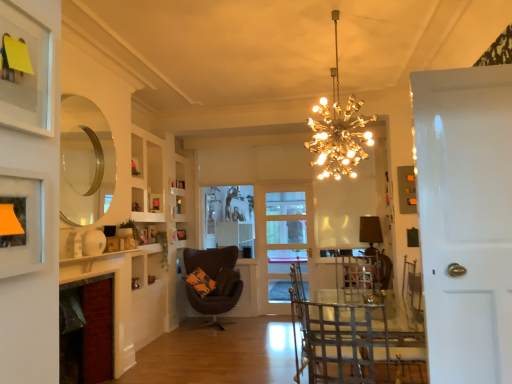
This screenshot has width=512, height=384. What do you see at coordinates (465, 220) in the screenshot? I see `white glossy door at right, the 1th door when ordered from front to back` at bounding box center [465, 220].

Find the location of a particular element. gold metallic chandelier at upper center is located at coordinates (338, 130).

Measure the distance between metallic wrought iron chair at lower center, the second chair from the back, and camera.

metallic wrought iron chair at lower center, the second chair from the back, and camera are 2.04 meters apart.

The image size is (512, 384). What do you see at coordinates (282, 238) in the screenshot? I see `light wood glass door at center, placed as the first door when sorted from back to front` at bounding box center [282, 238].

The height and width of the screenshot is (384, 512). What are the coordinates of `matte black picture frame at upper center, which appears as the 3th picture frame when viewed from the right` in the screenshot? It's located at (180, 184).

At what (x,y) coordinates should I click in order to perform the action: click on white glossy door at right, which ranks as the second door in back-to-front order. Please return your answer as a coordinate pair (x, y). Looking at the image, I should click on (465, 220).

Where is `the 3rd picture frame to the left of the matte gray picture frame at upper right, arranged as the fourth picture frame when viewed from the back, counting from the anchor's position`? Image resolution: width=512 pixels, height=384 pixels. the 3rd picture frame to the left of the matte gray picture frame at upper right, arranged as the fourth picture frame when viewed from the back, counting from the anchor's position is located at coordinates (181, 234).

Is the depth of matte gray picture frame at upper right, acting as the fifth picture frame starting from the left, less than that of matte black picture frame at center, which is the second picture frame in left-to-right order?

That is True.

From a real-world perspective, is matte gray picture frame at upper right, marked as the 1th picture frame in a right-to-left arrangement, located higher than matte black picture frame at center, the first picture frame in the back-to-front sequence?

Indeed, from a real-world perspective, matte gray picture frame at upper right, marked as the 1th picture frame in a right-to-left arrangement, stands above matte black picture frame at center, the first picture frame in the back-to-front sequence.

From the image's perspective, between matte gray picture frame at upper right, which appears as the second picture frame when viewed from the front, and matte black picture frame at center, the fourth picture frame when ordered from right to left, which one is located above?

matte gray picture frame at upper right, which appears as the second picture frame when viewed from the front, is shown above in the image.

Based on the photo, is red brick fireplace at lower left wider or thinner than matte gray picture frame at upper right, marked as the 1th picture frame in a right-to-left arrangement?

Clearly, red brick fireplace at lower left has more width compared to matte gray picture frame at upper right, marked as the 1th picture frame in a right-to-left arrangement.

From the image's perspective, is red brick fireplace at lower left on top of matte gray picture frame at upper right, arranged as the fourth picture frame when viewed from the back?

No, from the image's perspective, red brick fireplace at lower left is not above matte gray picture frame at upper right, arranged as the fourth picture frame when viewed from the back.

Considering the relative sizes of red brick fireplace at lower left and matte gray picture frame at upper right, marked as the 1th picture frame in a right-to-left arrangement, in the image provided, is red brick fireplace at lower left shorter than matte gray picture frame at upper right, marked as the 1th picture frame in a right-to-left arrangement,?

Incorrect, the height of red brick fireplace at lower left does not fall short of that of matte gray picture frame at upper right, marked as the 1th picture frame in a right-to-left arrangement.

Which picture frame is the 1st one when counting from the back of the metallic wire armchair at center? Please provide its 2D coordinates.

[(407, 189)]

Considering the positions of objects matte gray picture frame at upper right, acting as the fifth picture frame starting from the left, and metallic wire armchair at center in the image provided, who is more to the left, matte gray picture frame at upper right, acting as the fifth picture frame starting from the left, or metallic wire armchair at center?

From the viewer's perspective, metallic wire armchair at center appears more on the left side.

Is matte gray picture frame at upper right, acting as the fifth picture frame starting from the left, turned away from metallic wire armchair at center?

No.

Would you say white glossy door at right, the 1th door when ordered from front to back, contains matte black picture frame at upper left, positioned as the 5th picture frame in back-to-front order?

No.

Considering the relative sizes of white glossy door at right, which ranks as the second door in back-to-front order, and matte black picture frame at upper left, which is counted as the 1th picture frame, starting from the front, in the image provided, is white glossy door at right, which ranks as the second door in back-to-front order, taller than matte black picture frame at upper left, which is counted as the 1th picture frame, starting from the front,?

Yes.

How distant is white glossy door at right, which ranks as the second door in back-to-front order, from matte black picture frame at upper left, which is counted as the 1th picture frame, starting from the front?

white glossy door at right, which ranks as the second door in back-to-front order, and matte black picture frame at upper left, which is counted as the 1th picture frame, starting from the front, are 1.59 meters apart.

From a real-world perspective, is white glossy door at right, which ranks as the second door in back-to-front order, located higher than matte black picture frame at upper left, which is counted as the 1th picture frame, starting from the front?

Incorrect, from a real-world perspective, white glossy door at right, which ranks as the second door in back-to-front order, is lower than matte black picture frame at upper left, which is counted as the 1th picture frame, starting from the front.

Based on the photo, does clear glass mirror at upper left appear on the right side of gold metallic chandelier at upper center?

In fact, clear glass mirror at upper left is to the left of gold metallic chandelier at upper center.

From the image's perspective, is clear glass mirror at upper left beneath gold metallic chandelier at upper center?

Yes.

Would you consider clear glass mirror at upper left to be distant from gold metallic chandelier at upper center?

Yes, clear glass mirror at upper left and gold metallic chandelier at upper center are located far from each other.

Can you confirm if clear glass mirror at upper left is shorter than gold metallic chandelier at upper center?

No.

Consider the image. From a real-world perspective, relative to matte black picture frame at upper center, which ranks as the 3th picture frame in front-to-back order, is metallic wire armchair at center vertically above or below?

From a real-world perspective, metallic wire armchair at center is physically below matte black picture frame at upper center, which ranks as the 3th picture frame in front-to-back order.

How far apart are metallic wire armchair at center and matte black picture frame at upper center, which ranks as the 3th picture frame in front-to-back order?

The distance of metallic wire armchair at center from matte black picture frame at upper center, which ranks as the 3th picture frame in front-to-back order, is 3.43 meters.

Considering the positions of objects metallic wire armchair at center and matte black picture frame at upper center, arranged as the first picture frame when viewed from the left, in the image provided, who is more to the left, metallic wire armchair at center or matte black picture frame at upper center, arranged as the first picture frame when viewed from the left,?

matte black picture frame at upper center, arranged as the first picture frame when viewed from the left, is more to the left.

Is point (296, 265) behind point (152, 208)?

That is True.

Considering the points (294, 294) and (180, 234), which point is in front, point (294, 294) or point (180, 234)?

Positioned in front is point (294, 294).

In terms of size, does metallic wire armchair at center appear bigger or smaller than matte black picture frame at center, which is the second picture frame in left-to-right order?

Clearly, metallic wire armchair at center is larger in size than matte black picture frame at center, which is the second picture frame in left-to-right order.

Consider the image. Would you consider metallic wire armchair at center to be distant from matte black picture frame at center, the first picture frame in the back-to-front sequence?

Indeed, metallic wire armchair at center is not near matte black picture frame at center, the first picture frame in the back-to-front sequence.

From the image's perspective, between metallic wire armchair at center and matte black picture frame at center, the 5th picture frame in the front-to-back sequence, who is located below?

metallic wire armchair at center is shown below in the image.

Locate an element on the screen. This screenshot has height=384, width=512. picture frame that is the 3rd object to the left of the matte gray picture frame at upper right, which appears as the second picture frame when viewed from the front, starting at the anchor is located at coordinates (181, 234).

The height and width of the screenshot is (384, 512). Identify the location of fireplace in front of the matte gray picture frame at upper right, which appears as the second picture frame when viewed from the front. (x=87, y=331).

From the image, which object appears to be farther from white glossy door at right, which ranks as the second door in back-to-front order, matte black picture frame at upper center, positioned as the 4th picture frame in front-to-back order, or matte gray picture frame at upper right, marked as the 1th picture frame in a right-to-left arrangement?

matte black picture frame at upper center, positioned as the 4th picture frame in front-to-back order, is positioned further to the anchor white glossy door at right, which ranks as the second door in back-to-front order.

Estimate the real-world distances between objects in this image. Which object is further from clear glass mirror at upper left, matte black picture frame at upper center, placed as the 2th picture frame when sorted from back to front, or matte black picture frame at upper center, which ranks as the 3th picture frame in front-to-back order?

The object further to clear glass mirror at upper left is matte black picture frame at upper center, placed as the 2th picture frame when sorted from back to front.

Which object lies nearer to the anchor point gold metallic chandelier at upper center, matte black picture frame at center, the 5th picture frame in the front-to-back sequence, or matte black picture frame at upper center, arranged as the first picture frame when viewed from the left?

The object closer to gold metallic chandelier at upper center is matte black picture frame at upper center, arranged as the first picture frame when viewed from the left.

Considering their positions, is dark brown leather chair at lower left, the 2th chair viewed from the right, positioned closer to matte black picture frame at upper left, which is counted as the fourth picture frame, starting from the left, than matte gray picture frame at upper right, acting as the fifth picture frame starting from the left?

dark brown leather chair at lower left, the 2th chair viewed from the right, lies closer to matte black picture frame at upper left, which is counted as the fourth picture frame, starting from the left, than the other object.

Considering their positions, is matte black picture frame at upper center, arranged as the first picture frame when viewed from the left, positioned further to dark brown leather chair at lower left, the first chair when ordered from left to right, than matte gray picture frame at upper right, acting as the fifth picture frame starting from the left?

matte gray picture frame at upper right, acting as the fifth picture frame starting from the left, lies further to dark brown leather chair at lower left, the first chair when ordered from left to right, than the other object.

Based on their spatial positions, is clear glass mirror at upper left or matte black picture frame at center, the 5th picture frame in the front-to-back sequence, closer to metallic wire armchair at center?

clear glass mirror at upper left is positioned closer to the anchor metallic wire armchair at center.

Considering their positions, is matte gray picture frame at upper right, acting as the fifth picture frame starting from the left, positioned closer to matte black picture frame at upper center, which ranks as the 3th picture frame in front-to-back order, than gold metallic chandelier at upper center?

The object closer to matte black picture frame at upper center, which ranks as the 3th picture frame in front-to-back order, is gold metallic chandelier at upper center.

Estimate the real-world distances between objects in this image. Which object is closer to light wood glass door at center, marked as the second door in a front-to-back arrangement, metallic wrought iron chair at lower center, the first chair when ordered from right to left, or dark brown leather chair at lower left, the 2th chair viewed from the right?

dark brown leather chair at lower left, the 2th chair viewed from the right, lies closer to light wood glass door at center, marked as the second door in a front-to-back arrangement, than the other object.

I want to click on light fixture between matte black picture frame at upper left, positioned as the 5th picture frame in back-to-front order, and matte black picture frame at upper center, which ranks as the 3th picture frame in front-to-back order, in the front-back direction, so click(338, 130).

I want to click on fireplace between gold metallic chandelier at upper center and matte black picture frame at center, the first picture frame in the back-to-front sequence, along the z-axis, so click(87, 331).

The image size is (512, 384). Identify the location of fireplace positioned between metallic wire armchair at center and matte black picture frame at center, the 5th picture frame in the front-to-back sequence, from near to far. (87, 331).

The height and width of the screenshot is (384, 512). In order to click on chair positioned between matte black picture frame at upper left, positioned as the 5th picture frame in back-to-front order, and dark brown leather chair at lower left, arranged as the first chair when viewed from the back, from near to far in this screenshot , I will do `click(351, 343)`.